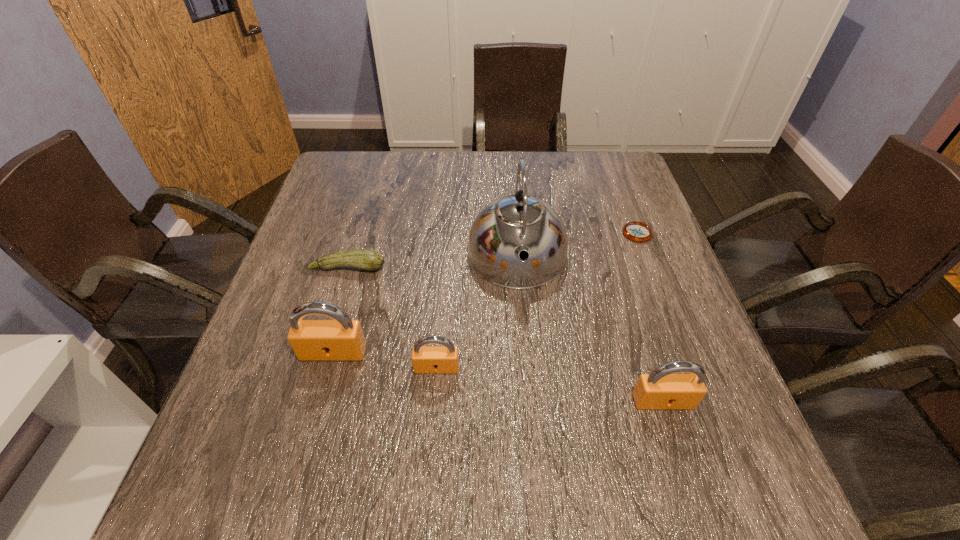
Find the location of a particular element. vacant region at the far edge of the desktop is located at coordinates (535, 159).

The image size is (960, 540). Find the location of `vacant space at the near edge of the desktop`. vacant space at the near edge of the desktop is located at coordinates (319, 437).

In the image, there is a desktop. In order to click on vacant space at the left edge in this screenshot , I will do `click(301, 239)`.

You are a GUI agent. You are given a task and a screenshot of the screen. Output one action in this format:
    pyautogui.click(x=<x>, y=<y>)
    Task: Click on the free spot at the right edge of the desktop
    This screenshot has width=960, height=540.
    Given the screenshot: What is the action you would take?
    pyautogui.click(x=681, y=373)

Locate an element on the screen. This screenshot has height=540, width=960. vacant space at the far left corner is located at coordinates (361, 152).

This screenshot has height=540, width=960. In the image, there is a desktop. Find the location of `vacant space at the near left corner`. vacant space at the near left corner is located at coordinates (245, 409).

Locate an element on the screen. free location at the far right corner of the desktop is located at coordinates (593, 193).

I want to click on blank region between the rightmost padlock and the third shortest object, so click(x=550, y=384).

Where is `free area in between the shortest padlock and the fifth tallest object`? free area in between the shortest padlock and the fifth tallest object is located at coordinates (393, 318).

I want to click on blank region between the tallest padlock and the third shortest object, so click(x=385, y=360).